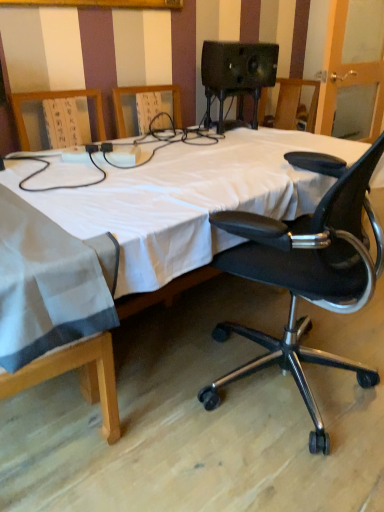
I want to click on vacant space underneath black matte office chair at right (from a real-world perspective), so click(316, 390).